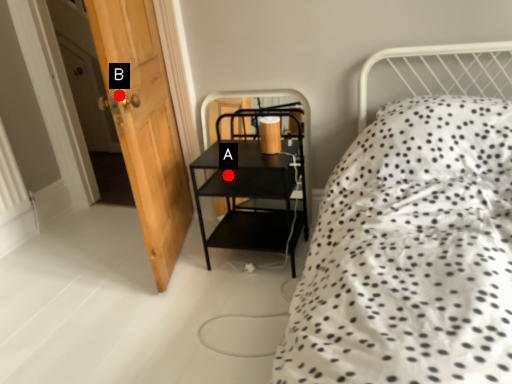
Question: Two points are circled on the image, labeled by A and B beside each circle. Which point is closer to the camera?

Choices:
 (A) A is closer
 (B) B is closer

Answer: (B)